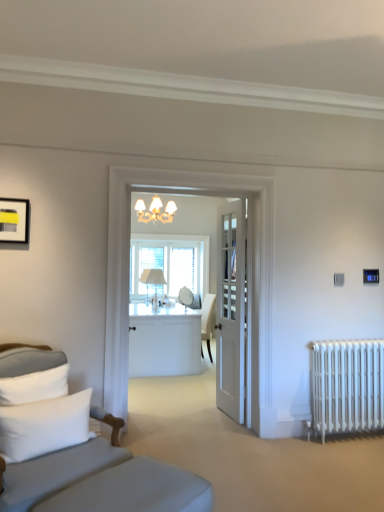
Question: Is white glossy desk at center in front of or behind clear glass window at center in the image?

Choices:
 (A) behind
 (B) front

Answer: (B)

Question: From a real-world perspective, is white glossy desk at center above or below clear glass window at center?

Choices:
 (A) above
 (B) below

Answer: (B)

Question: Which object is the closest to the white metal radiator at lower right?

Choices:
 (A) matte black picture frame at upper left
 (B) clear glass window at center
 (C) white glossy desk at center
 (D) white soft pillow at lower left
 (E) white fabric table lamp at center

Answer: (D)

Question: Which of these objects is positioned closest to the white glossy desk at center?

Choices:
 (A) white soft pillow at lower left
 (B) gray fabric studio couch at left
 (C) white metal radiator at lower right
 (D) white fabric table lamp at center
 (E) white wooden door at center

Answer: (D)